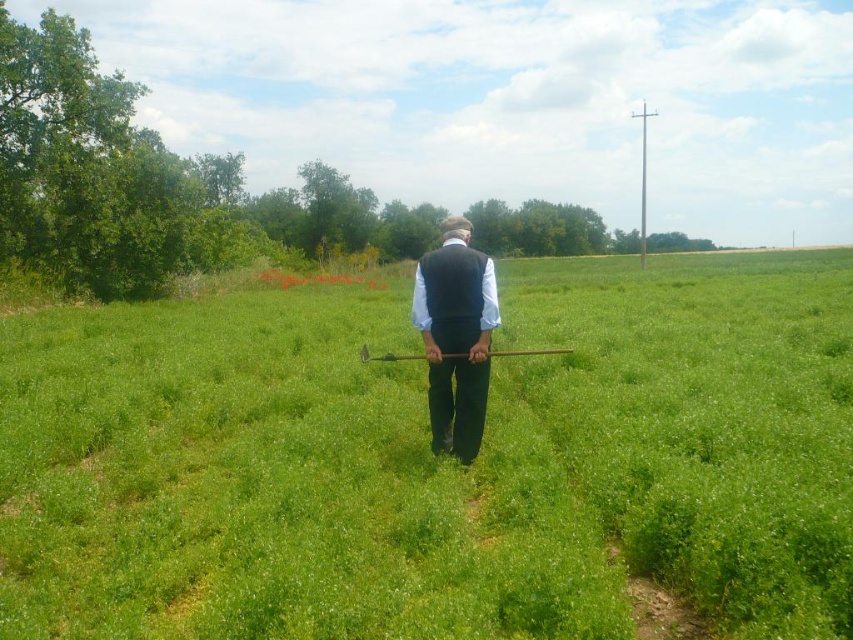
You are standing in the green grassy field at center and want to find the black matte vest at center. In which direction should you walk to locate it?

The black matte vest at center is on the left side of the green grassy field at center, so you should walk to the left to locate it.